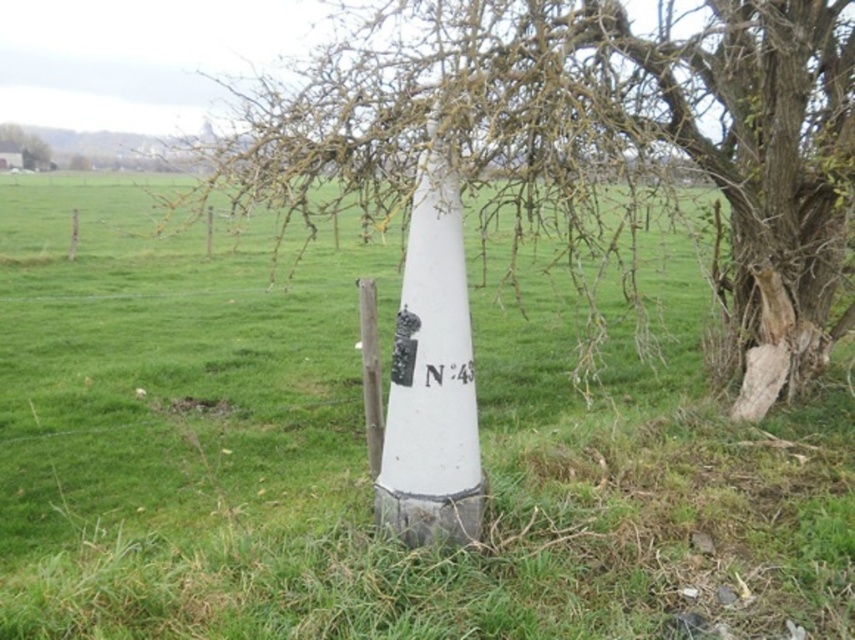
Question: Estimate the real-world distances between objects in this image. Which object is farther from the smooth bark tree at center?

Choices:
 (A) brown bark tree at upper left
 (B) green grassy at center
 (C) white painted wood post at center
 (D) black plastic sign at center

Answer: (A)

Question: Is green grassy at center above white painted wood post at center?

Choices:
 (A) yes
 (B) no

Answer: (A)

Question: Where is green grassy at center located in relation to brown bark tree at upper left in the image?

Choices:
 (A) below
 (B) above

Answer: (A)

Question: Is the position of white painted wood post at center more distant than that of brown bark tree at upper left?

Choices:
 (A) yes
 (B) no

Answer: (B)

Question: Considering the real-world distances, which object is farthest from the brown bark tree at upper left?

Choices:
 (A) green grassy at center
 (B) white painted wood post at center
 (C) black plastic sign at center

Answer: (C)

Question: Which point appears closest to the camera in this image?

Choices:
 (A) tap(472, 376)
 (B) tap(28, 131)

Answer: (A)